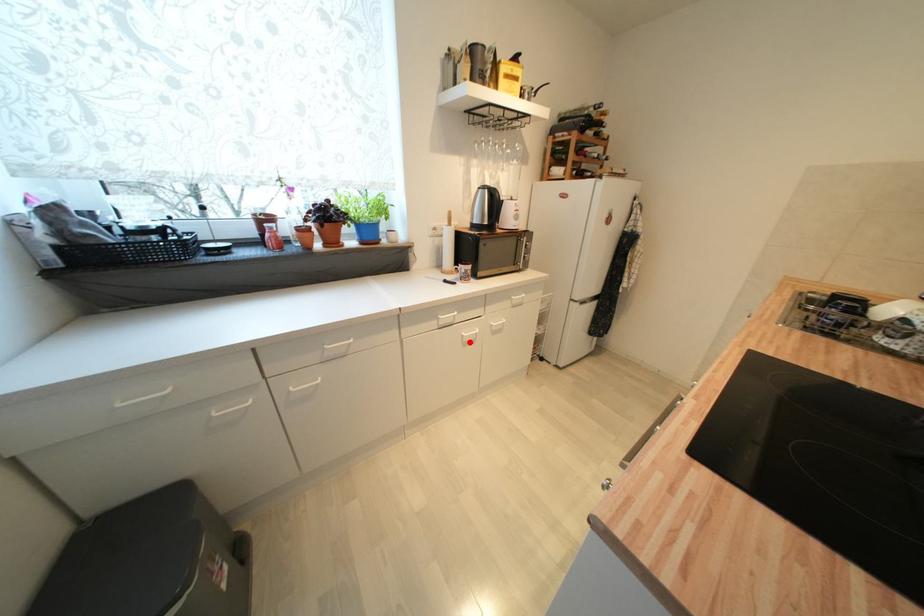
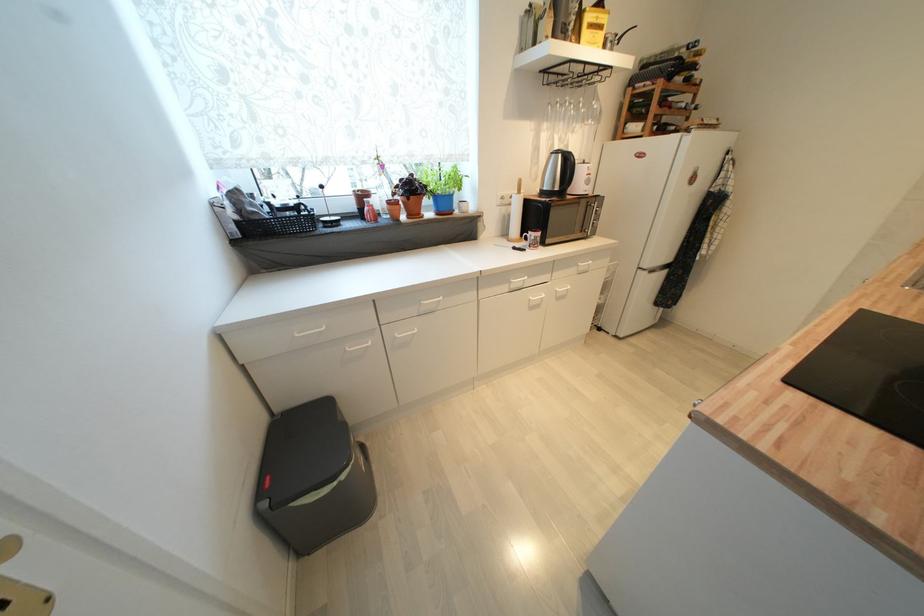
Question: I am providing you with two images of the same scene from different viewpoints. A red point is marked on the first image. At the location where the point appears in image 1, is it still visible in image 2?

Choices:
 (A) Yes
 (B) No

Answer: (A)